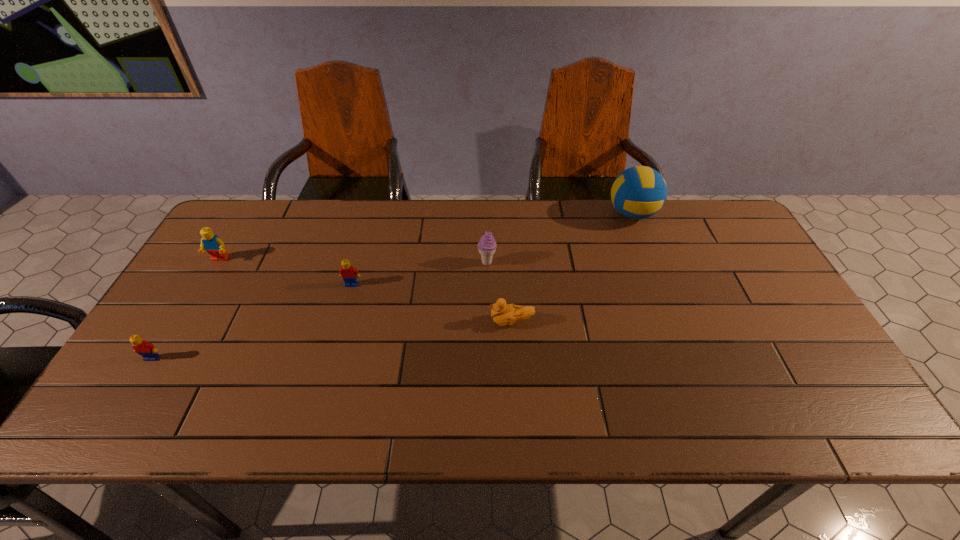
You are a GUI agent. You are given a task and a screenshot of the screen. Output one action in this format:
    pyautogui.click(x=<x>, y=<y>)
    Task: Click on the unoccupied position between the icecream and the fourth object from right to left
    This screenshot has height=540, width=960.
    Given the screenshot: What is the action you would take?
    420,273

This screenshot has width=960, height=540. What are the coordinates of `object that is the third nearest to the fifth farthest object` in the screenshot? It's located at (639, 192).

Where is `object that is the fifth closest to the volleyball`? object that is the fifth closest to the volleyball is located at coordinates (147, 350).

Identify the location of Lego that stands as the closest to the nearest object. This screenshot has height=540, width=960. (213, 245).

Identify which Lego is the second nearest to the farthest Lego. Please provide its 2D coordinates. Your answer should be formatted as a tuple, i.e. [(x, y)], where the tuple contains the x and y coordinates of a point satisfying the conditions above.

[(349, 274)]

Locate an element on the screen. free region that satisfies the following two spatial constraints: 1. on the front-facing side of the icecream; 2. on the right side of the tallest Lego is located at coordinates (218, 262).

Where is `vacant position in the image that satisfies the following two spatial constraints: 1. on the front-facing side of the farthest Lego; 2. on the left side of the icecream`? Image resolution: width=960 pixels, height=540 pixels. vacant position in the image that satisfies the following two spatial constraints: 1. on the front-facing side of the farthest Lego; 2. on the left side of the icecream is located at coordinates (218, 262).